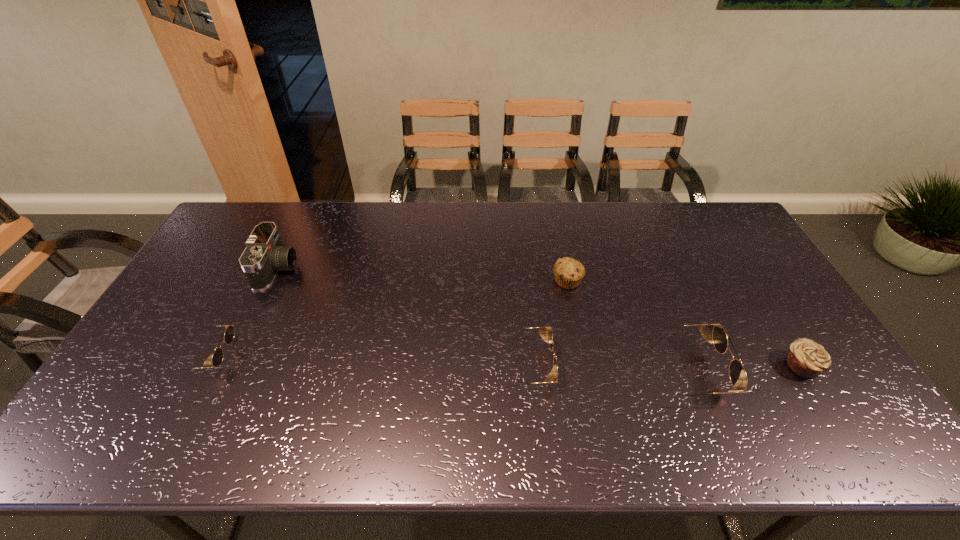
Image resolution: width=960 pixels, height=540 pixels. Find the location of `the leftmost sunglasses`. the leftmost sunglasses is located at coordinates (217, 358).

Where is `the second tallest sunglasses`? The image size is (960, 540). the second tallest sunglasses is located at coordinates (543, 331).

Where is `the second sunglasses from right to left`? Image resolution: width=960 pixels, height=540 pixels. the second sunglasses from right to left is located at coordinates (543, 331).

The height and width of the screenshot is (540, 960). I want to click on the tallest sunglasses, so click(737, 373).

Where is `the second object from right to left`? Image resolution: width=960 pixels, height=540 pixels. the second object from right to left is located at coordinates (737, 373).

Locate an element on the screen. The height and width of the screenshot is (540, 960). the left muffin is located at coordinates (568, 273).

You are a GUI agent. You are given a task and a screenshot of the screen. Output one action in this format:
    pyautogui.click(x=<x>, y=<y>)
    Task: Click on the farther muffin
    
    Given the screenshot: What is the action you would take?
    pyautogui.click(x=568, y=273)

This screenshot has width=960, height=540. Find the location of `camera`. camera is located at coordinates (264, 255).

This screenshot has height=540, width=960. I want to click on the right muffin, so click(806, 358).

This screenshot has width=960, height=540. In order to click on the nearer muffin in this screenshot , I will do `click(806, 358)`.